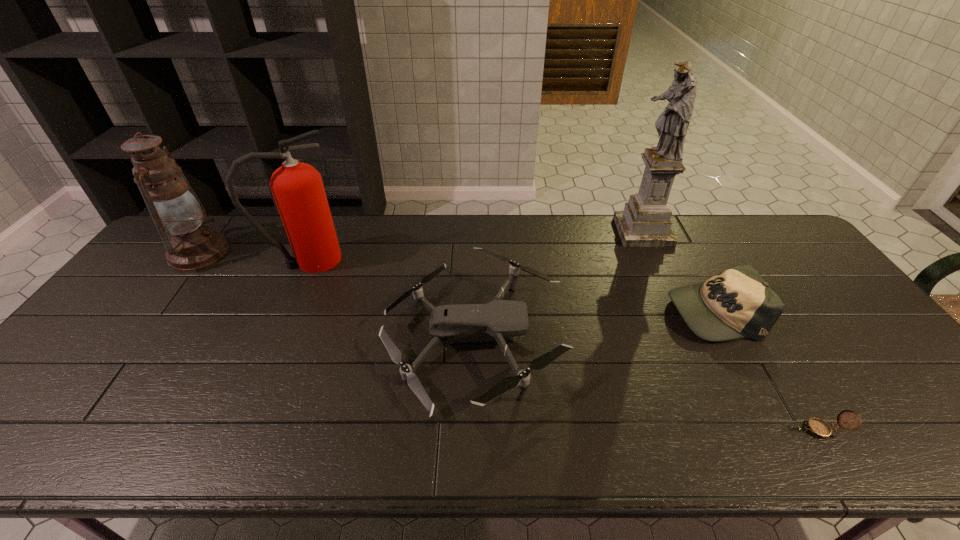
Find the location of a particular element. The image size is (960, 540). oil lamp present at the far edge is located at coordinates (191, 244).

Locate an element on the screen. Image resolution: width=960 pixels, height=540 pixels. drone that is at the near edge is located at coordinates (493, 321).

Locate an element on the screen. The height and width of the screenshot is (540, 960). compass located at the near edge is located at coordinates (820, 429).

Identify the location of object that is at the left edge. (191, 244).

Locate an element on the screen. object that is at the far left corner is located at coordinates (191, 244).

You are a GUI agent. You are given a task and a screenshot of the screen. Output one action in this format:
    pyautogui.click(x=<x>, y=<y>)
    Task: Click on the blank area at the far edge
    
    Given the screenshot: What is the action you would take?
    pyautogui.click(x=728, y=252)

At what (x,y) coordinates should I click in order to perform the action: click on free space at the near edge of the desktop. Please return your answer as a coordinate pair (x, y). The image size is (960, 540). Looking at the image, I should click on (669, 457).

The height and width of the screenshot is (540, 960). Find the location of `free space at the right edge of the desktop`. free space at the right edge of the desktop is located at coordinates point(886,376).

This screenshot has height=540, width=960. What are the coordinates of `blank space at the far right corner` in the screenshot? It's located at (745, 235).

Locate an element on the screen. This screenshot has height=540, width=960. free spot between the compass and the drone is located at coordinates (647, 384).